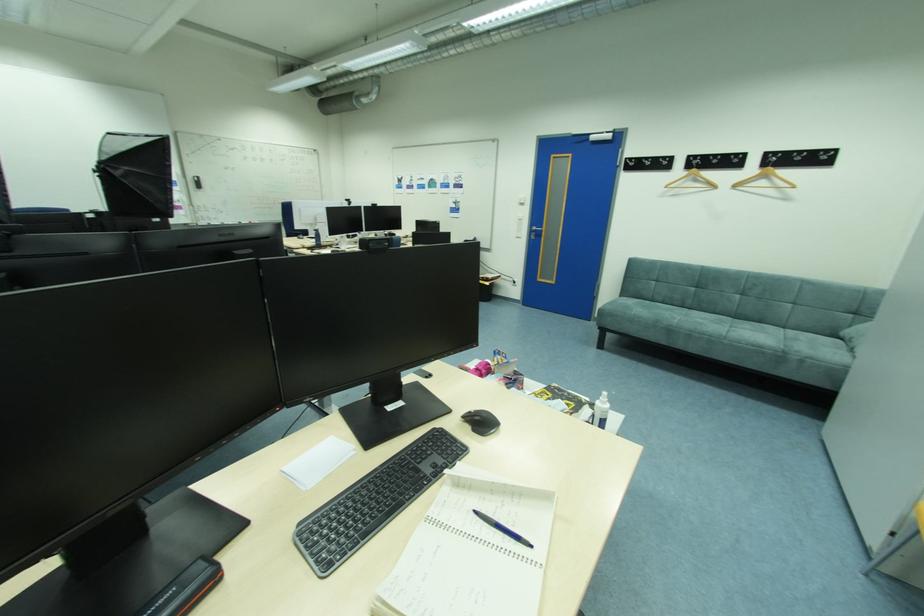
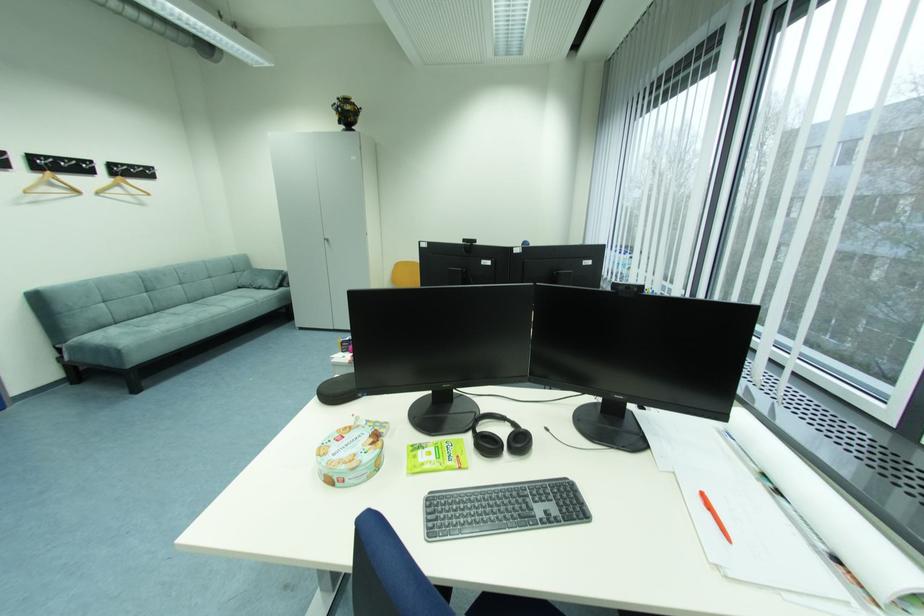
Where in the second image is the point corresponding to [742,188] from the first image?

(104, 193)